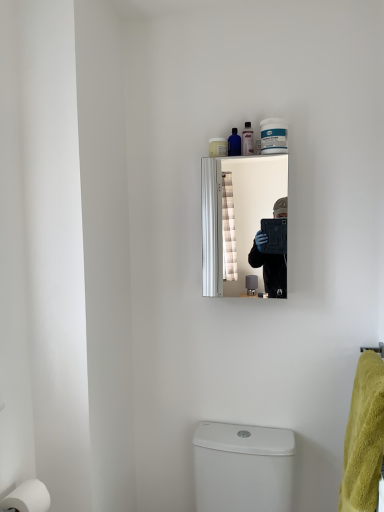
Question: Would you say translucent plastic soap dispenser at upper center, the third toiletry viewed from the right, is to the left or to the right of yellow fluffy bath towel at right in the picture?

Choices:
 (A) left
 (B) right

Answer: (A)

Question: From a real-world perspective, relative to yellow fluffy bath towel at right, is translucent plastic soap dispenser at upper center, the third toiletry viewed from the right, vertically above or below?

Choices:
 (A) above
 (B) below

Answer: (A)

Question: Which object is positioned closest to the yellow fluffy bath towel at right?

Choices:
 (A) white glossy toilet at lower center
 (B) translucent blue bottle at upper center, which is the second toiletry in left-to-right order
 (C) translucent plastic soap dispenser at upper center, the third toiletry viewed from the right
 (D) white matte toilet paper at lower left
 (E) translucent plastic bottle at upper center, positioned as the 3th toiletry in left-to-right order

Answer: (A)

Question: Which object is positioned closest to the translucent plastic bottle at upper center, positioned as the 3th toiletry in left-to-right order?

Choices:
 (A) white matte toilet paper at lower left
 (B) translucent plastic soap dispenser at upper center, the first toiletry in the left-to-right sequence
 (C) white glossy toilet at lower center
 (D) yellow fluffy bath towel at right
 (E) silver metallic mirror at upper center

Answer: (B)